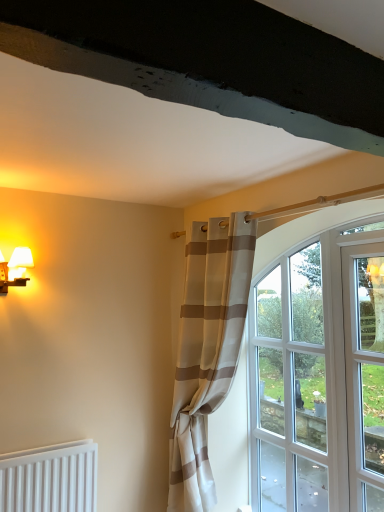
Question: From the image's perspective, is beige striped curtain at center above clear glass door at right?

Choices:
 (A) no
 (B) yes

Answer: (A)

Question: Considering the relative sizes of beige striped curtain at center and clear glass door at right in the image provided, is beige striped curtain at center thinner than clear glass door at right?

Choices:
 (A) yes
 (B) no

Answer: (B)

Question: Considering the relative positions of beige striped curtain at center and clear glass door at right in the image provided, is beige striped curtain at center to the right of clear glass door at right from the viewer's perspective?

Choices:
 (A) yes
 (B) no

Answer: (B)

Question: From a real-world perspective, is beige striped curtain at center positioned under clear glass door at right based on gravity?

Choices:
 (A) yes
 (B) no

Answer: (A)

Question: Is clear glass door at right inside beige striped curtain at center?

Choices:
 (A) yes
 (B) no

Answer: (B)

Question: Do you think clear glass door at right is within beige striped curtain at center, or outside of it?

Choices:
 (A) inside
 (B) outside

Answer: (B)

Question: From the image's perspective, is clear glass door at right positioned above or below beige striped curtain at center?

Choices:
 (A) above
 (B) below

Answer: (A)

Question: Looking at the image, does clear glass door at right seem bigger or smaller compared to beige striped curtain at center?

Choices:
 (A) small
 (B) big

Answer: (A)

Question: Is clear glass door at right in front of or behind beige striped curtain at center in the image?

Choices:
 (A) front
 (B) behind

Answer: (A)

Question: From their relative heights in the image, would you say beige striped curtain at center is taller or shorter than matte white table lamp at left?

Choices:
 (A) short
 (B) tall

Answer: (B)

Question: Relative to matte white table lamp at left, is beige striped curtain at center in front or behind?

Choices:
 (A) front
 (B) behind

Answer: (A)

Question: Considering the relative positions of beige striped curtain at center and matte white table lamp at left in the image provided, is beige striped curtain at center to the left or to the right of matte white table lamp at left?

Choices:
 (A) right
 (B) left

Answer: (A)

Question: From the image's perspective, is beige striped curtain at center above or below matte white table lamp at left?

Choices:
 (A) above
 (B) below

Answer: (B)

Question: Which is correct: matte white table lamp at left is inside clear glass window at center, or outside of it?

Choices:
 (A) outside
 (B) inside

Answer: (A)

Question: In the image, is matte white table lamp at left positioned in front of or behind clear glass window at center?

Choices:
 (A) front
 (B) behind

Answer: (A)